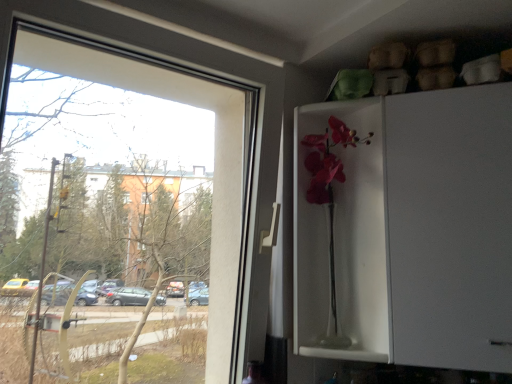
Question: From the image's perspective, is white glossy cabinet at upper right above or below matte glass vase at center?

Choices:
 (A) above
 (B) below

Answer: (B)

Question: Choose the correct answer: Is white glossy cabinet at upper right inside matte glass vase at center or outside it?

Choices:
 (A) inside
 (B) outside

Answer: (B)

Question: Which of these objects is positioned closest to the white glossy cabinet at upper right?

Choices:
 (A) matte glass vase at center
 (B) transparent glass window at left

Answer: (A)

Question: Based on their relative distances, which object is nearer to the white glossy cabinet at upper right?

Choices:
 (A) matte glass vase at center
 (B) transparent glass window at left

Answer: (A)